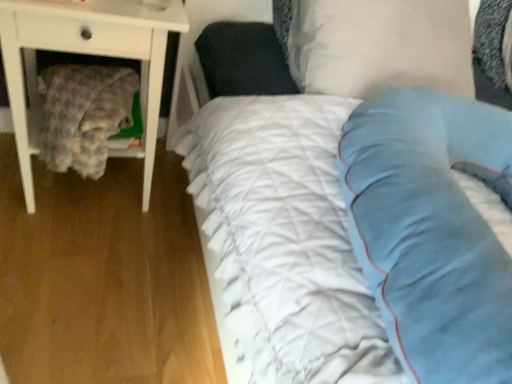
The image size is (512, 384). What are the coordinates of `free spot in front of white wood nightstand at left` in the screenshot? It's located at (69, 266).